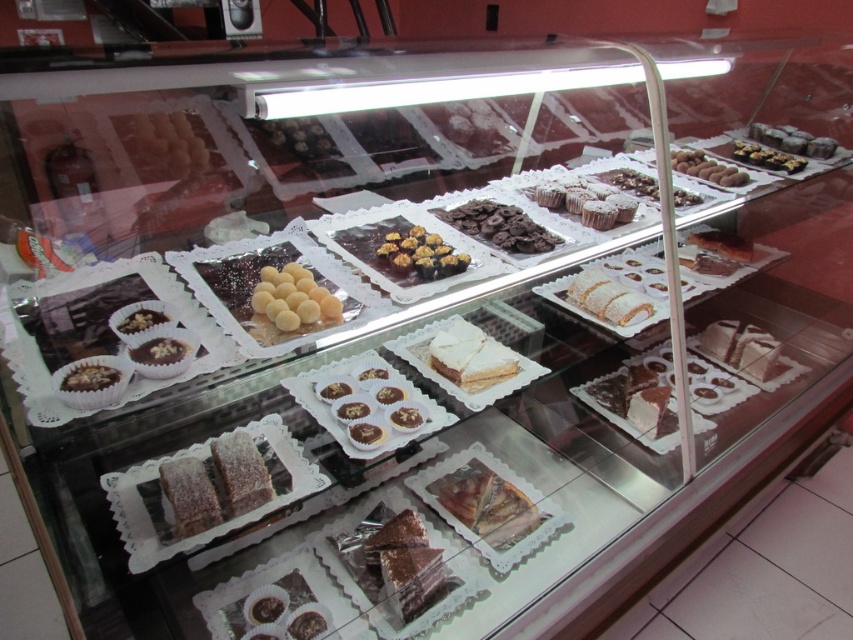
You are a customer at the bakery and want to choose a cake that is taller. Which one between the chocolate cake at center and the white creamy cake at center would you select?

The white creamy cake at center is taller than the chocolate cake at center, so you should choose the white creamy cake at center.

Based on the photo, you are a customer at the bakery and want to buy both the chocolate cake at center and the white creamy cake at center. If you have a box that is 12 inches long, will it be sufficient to carry both cakes side by side?

The distance between the chocolate cake at center and white creamy cake at center is 12.63 inches. Since the box is only 12 inches long, it is not long enough to accommodate both cakes side by side as they require 12.63 inches of space.